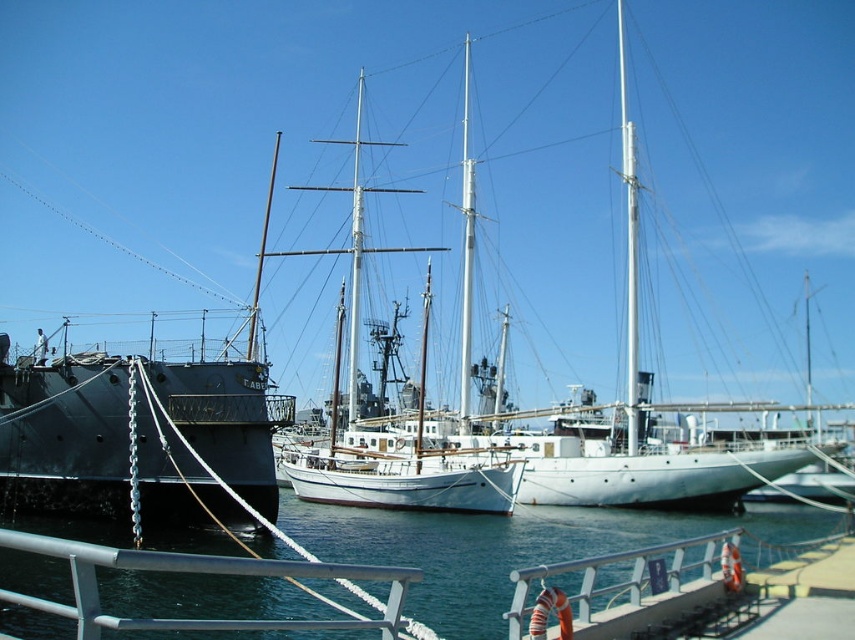
Does point (504, 536) come in front of point (267, 460)?

No, (504, 536) is behind (267, 460).

Identify the location of clear blue water at center. (506, 547).

Which is more to the right, matte black ship at left or white metallic mast at center?

white metallic mast at center is more to the right.

Identify the location of matte black ship at left. (96, 448).

Between point (183, 476) and point (628, 392), which one is positioned in front?

Point (183, 476) is more forward.

Image resolution: width=855 pixels, height=640 pixels. I want to click on matte black ship at left, so click(x=96, y=448).

From the picture: Can you confirm if clear blue water at center is taller than white matte mast at center?

No, clear blue water at center is not taller than white matte mast at center.

Who is more forward, (775,520) or (464,141)?

Positioned in front is point (775,520).

Which is behind, point (338, 636) or point (464, 422)?

The point (464, 422) is behind.

Locate an element on the screen. clear blue water at center is located at coordinates (506, 547).